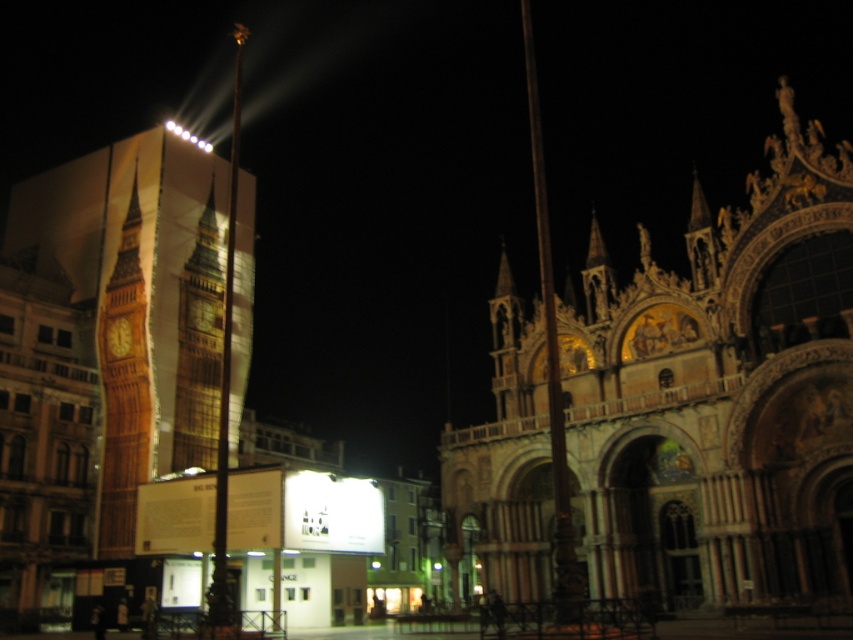
In the scene shown: Is shiny metallic flag pole at center to the right of matte gold clock at left from the viewer's perspective?

Yes, shiny metallic flag pole at center is to the right of matte gold clock at left.

How much distance is there between shiny metallic flag pole at center and matte gold clock at left?

18.13 meters

In order to click on shiny metallic flag pole at center in this screenshot , I will do `click(225, 387)`.

Locate an element on the screen. shiny metallic flag pole at center is located at coordinates (225, 387).

Can you confirm if wooden big ben at left is positioned below polished metal flag pole at center?

Indeed, wooden big ben at left is positioned under polished metal flag pole at center.

Can you confirm if wooden big ben at left is positioned above polished metal flag pole at center?

Incorrect, wooden big ben at left is not positioned above polished metal flag pole at center.

This screenshot has width=853, height=640. What are the coordinates of `wooden big ben at left` in the screenshot? It's located at (125, 392).

Locate an element on the screen. This screenshot has width=853, height=640. wooden big ben at left is located at coordinates (125, 392).

Is polished metal flag pole at center smaller than matte gold clock at left?

No, polished metal flag pole at center is not smaller than matte gold clock at left.

Is point (573, 540) behind point (108, 353)?

No, it is not.

Locate an element on the screen. The image size is (853, 640). polished metal flag pole at center is located at coordinates (550, 364).